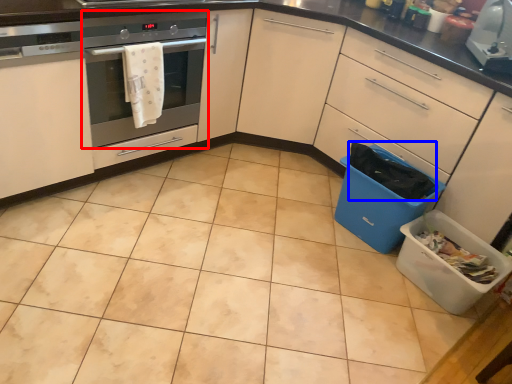
Question: Among these objects, which one is farthest to the camera, home appliance (highlighted by a red box) or material (highlighted by a blue box)?

Choices:
 (A) home appliance
 (B) material

Answer: (B)